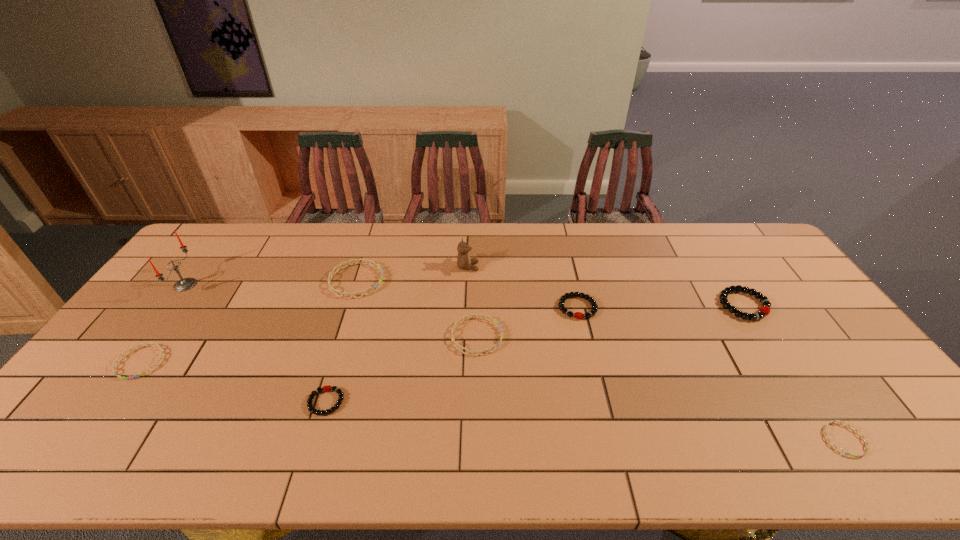
Where is `object present at the near right corner`? Image resolution: width=960 pixels, height=540 pixels. object present at the near right corner is located at coordinates (825, 433).

Where is `vacant space at the far edge of the desktop`? This screenshot has width=960, height=540. vacant space at the far edge of the desktop is located at coordinates (366, 259).

At what (x,y) coordinates should I click in order to perform the action: click on vacant space at the near edge of the desktop. Please return your answer as a coordinate pair (x, y). This screenshot has height=540, width=960. Looking at the image, I should click on (545, 462).

You are a GUI agent. You are given a task and a screenshot of the screen. Output one action in this format:
    pyautogui.click(x=<x>, y=<y>)
    Task: Click on the vacant space at the far left corner of the desktop
    
    Given the screenshot: What is the action you would take?
    pyautogui.click(x=219, y=240)

In order to click on vacant region at the far right corner of the desktop in this screenshot , I will do `click(706, 225)`.

This screenshot has width=960, height=540. In order to click on vacant area that lies between the leftmost blue bracelet and the rightmost black bracelet in this screenshot , I will do point(443,334).

Where is `free space between the candle and the farthest blue bracelet`? The image size is (960, 540). free space between the candle and the farthest blue bracelet is located at coordinates (271, 283).

Where is `vacant point located between the third blue bracelet from left to right and the nearest black bracelet`? vacant point located between the third blue bracelet from left to right and the nearest black bracelet is located at coordinates (401, 369).

Identify the location of vacant area between the tallest object and the shortest object. (x=515, y=362).

I want to click on blank region between the second blue bracelet from left to right and the leftmost black bracelet, so click(x=341, y=341).